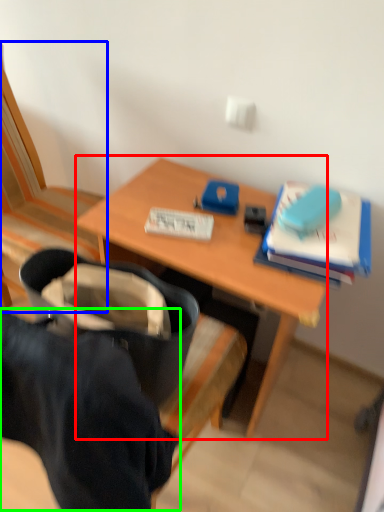
Question: Which is farther away from desk (highlighted by a red box)? chair (highlighted by a blue box) or clothing (highlighted by a green box)?

Choices:
 (A) chair
 (B) clothing

Answer: (B)